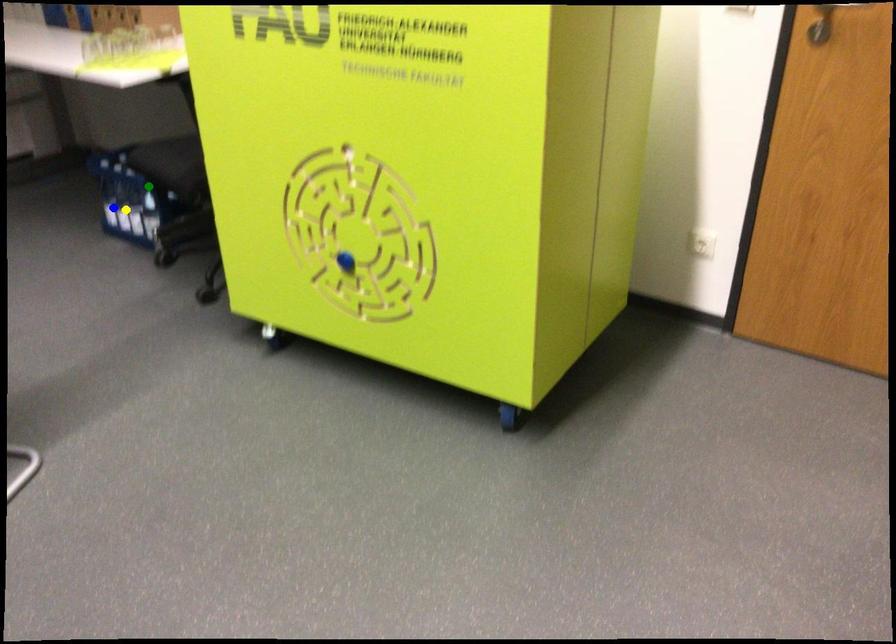
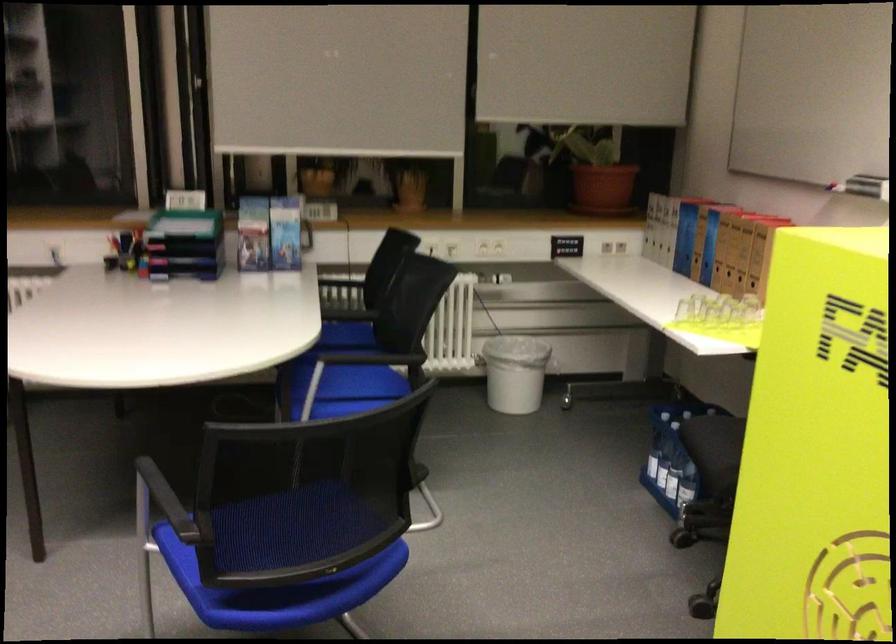
I am providing you with two images of the same scene from different viewpoints. Three points are marked in image1. Which point corresponds to a part or object that is occluded in image2?In image1, three points are marked. Which of them correspond to a part or object that is occluded in image2?Among the three points shown in image1, which one corresponds to a part or object that is no longer visible due to occlusion in image2?

Invisible in image2: green point.